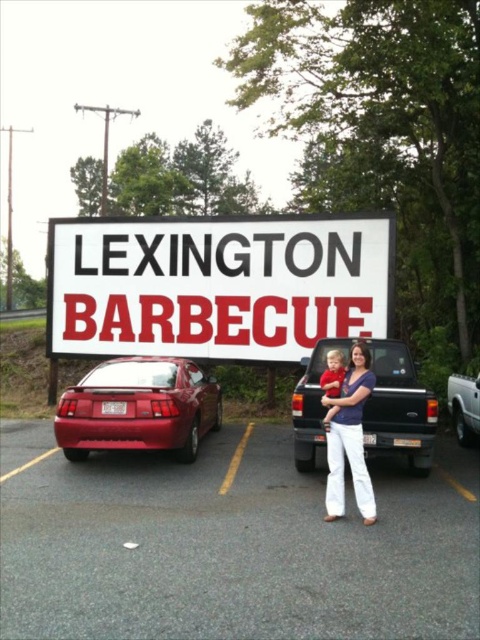
Who is lower down, white plastic sign at center or orange matte truck at center?

orange matte truck at center is lower down.

What do you see at coordinates (216, 284) in the screenshot? I see `white plastic sign at center` at bounding box center [216, 284].

Locate an element on the screen. white plastic sign at center is located at coordinates (216, 284).

Find the location of `white plastic sign at center`. white plastic sign at center is located at coordinates (216, 284).

Does white cotton pants at center appear under orange matte truck at center?

No, white cotton pants at center is not below orange matte truck at center.

Is white cotton pants at center positioned in front of orange matte truck at center?

Yes, white cotton pants at center is closer to the viewer.

Does point (333, 404) come closer to viewer compared to point (467, 387)?

Yes, point (333, 404) is in front of point (467, 387).

Identify the location of white cotton pants at center. (349, 440).

The image size is (480, 640). Identify the location of gray asphalt parking lot at center. (233, 548).

Where is `gray asphalt parking lot at center`? This screenshot has height=640, width=480. gray asphalt parking lot at center is located at coordinates (233, 548).